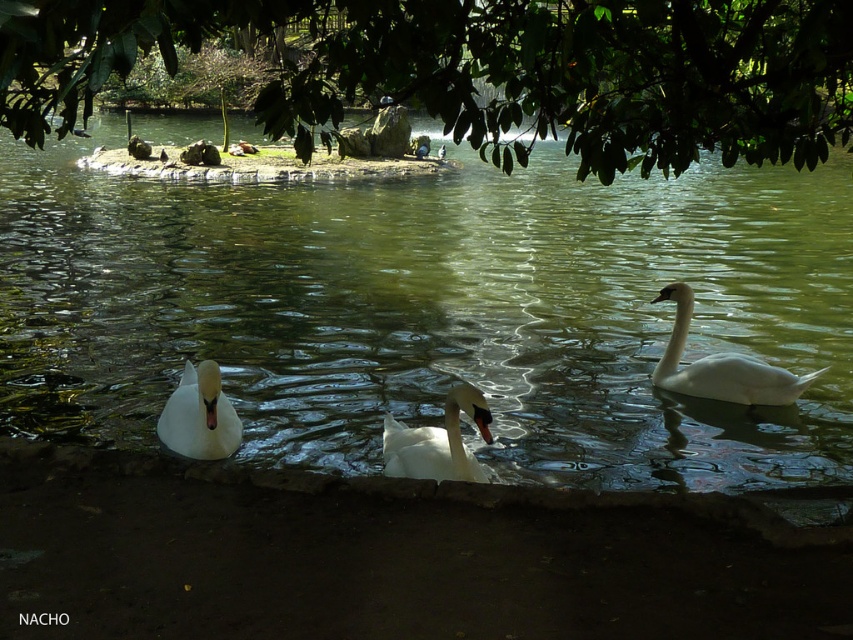
You are standing at the point with coordinates point (160, 433) and want to walk to the point with coordinates point (785, 381). Which direction should you move in to reach your destination?

To reach point (785, 381) from point (160, 433), you should move in the direction towards the upper left since point (785, 381) is behind point (160, 433).

You are a photographer trying to capture the swans in the scene. You notice two swans, the white glossy swan at right and the white glossy swan at center. Which swan appears closer to you based on their positions?

The white glossy swan at right is positioned over the white glossy swan at center, so the swan at right appears closer to you.

You are a photographer wanting to capture the clear water at center and the green leafy tree at upper center in your shot. Which of these two objects will occupy more space in your photo?

The clear water at center occupies more space in the photo because it is larger in size than the green leafy tree at upper center according to the description.